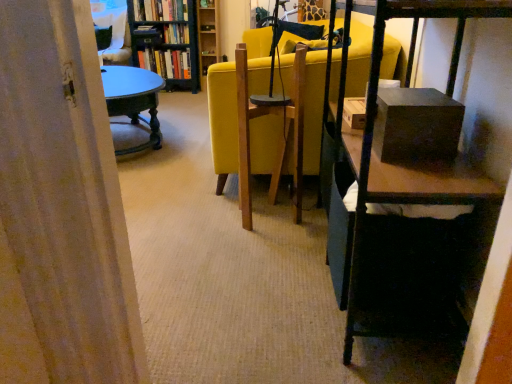
Question: Is wooden bookshelf at upper left positioned behind hardcover book at center, the 2th book in the top-to-bottom sequence?

Choices:
 (A) yes
 (B) no

Answer: (B)

Question: Is wooden bookshelf at upper left taller than hardcover book at center, placed as the 2th book when sorted from bottom to top?

Choices:
 (A) yes
 (B) no

Answer: (A)

Question: Is wooden bookshelf at upper left closer to the viewer compared to hardcover book at center, the 2th book in the top-to-bottom sequence?

Choices:
 (A) no
 (B) yes

Answer: (B)

Question: Considering the relative sizes of wooden bookshelf at upper left and hardcover book at center, the 2th book in the top-to-bottom sequence, in the image provided, is wooden bookshelf at upper left thinner than hardcover book at center, the 2th book in the top-to-bottom sequence,?

Choices:
 (A) no
 (B) yes

Answer: (A)

Question: Is wooden bookshelf at upper left positioned with its back to hardcover book at center, placed as the 2th book when sorted from bottom to top?

Choices:
 (A) no
 (B) yes

Answer: (B)

Question: Could hardcover book at center, placed as the 2th book when sorted from bottom to top, be considered to be inside wooden bookshelf at upper left?

Choices:
 (A) no
 (B) yes

Answer: (B)

Question: Does hardcover books at upper left, placed as the 1th book when sorted from top to bottom, have a lesser height compared to hardcover book at center, the 2th book in the top-to-bottom sequence?

Choices:
 (A) no
 (B) yes

Answer: (A)

Question: Is hardcover books at upper left, which is the 3th book from bottom to top, placed right next to hardcover book at center, the 2th book in the top-to-bottom sequence?

Choices:
 (A) no
 (B) yes

Answer: (A)

Question: From a real-world perspective, is hardcover books at upper left, placed as the 1th book when sorted from top to bottom, physically above hardcover book at center, placed as the 2th book when sorted from bottom to top?

Choices:
 (A) no
 (B) yes

Answer: (B)

Question: Is there a large distance between hardcover books at upper left, which is the 3th book from bottom to top, and hardcover book at center, the 2th book in the top-to-bottom sequence?

Choices:
 (A) no
 (B) yes

Answer: (A)

Question: From the image's perspective, does hardcover books at upper left, placed as the 1th book when sorted from top to bottom, appear higher than hardcover book at center, the 2th book in the top-to-bottom sequence?

Choices:
 (A) no
 (B) yes

Answer: (B)

Question: From a real-world perspective, is hardcover books at upper left, placed as the 1th book when sorted from top to bottom, positioned under hardcover book at center, the 2th book in the top-to-bottom sequence, based on gravity?

Choices:
 (A) yes
 (B) no

Answer: (B)

Question: Is wooden bookshelf at upper center wider than wooden bookshelf at upper left?

Choices:
 (A) no
 (B) yes

Answer: (A)